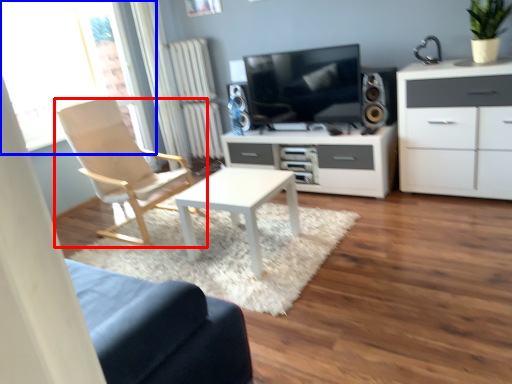
Question: Among these objects, which one is nearest to the camera, chair (highlighted by a red box) or window (highlighted by a blue box)?

Choices:
 (A) chair
 (B) window

Answer: (A)